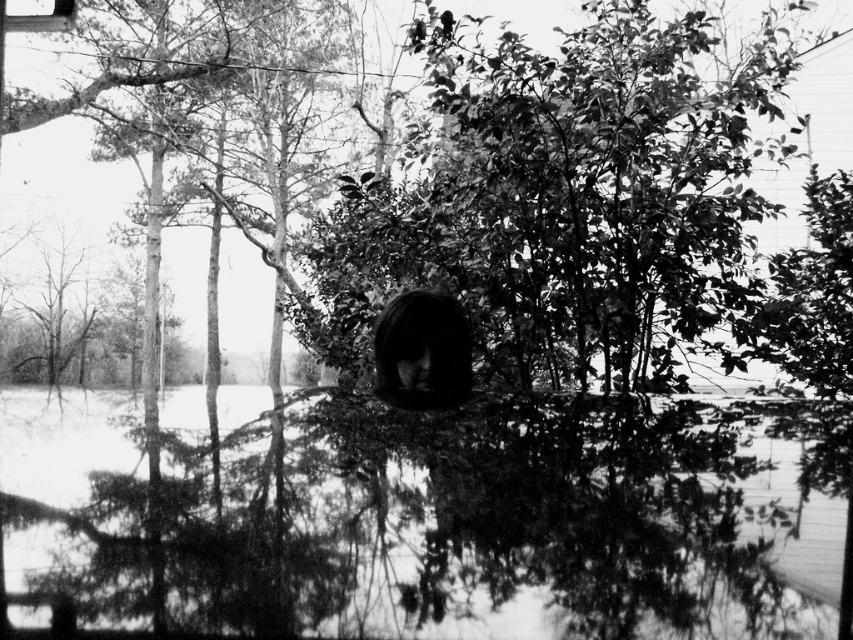
Between point (111, 444) and point (440, 396), which one is positioned behind?

The point (440, 396) is more distant.

Does transparent glass puddle at center have a greater height compared to dark hair at center?

Incorrect, transparent glass puddle at center's height is not larger of dark hair at center's.

Find the location of a particular element. transparent glass puddle at center is located at coordinates (479, 534).